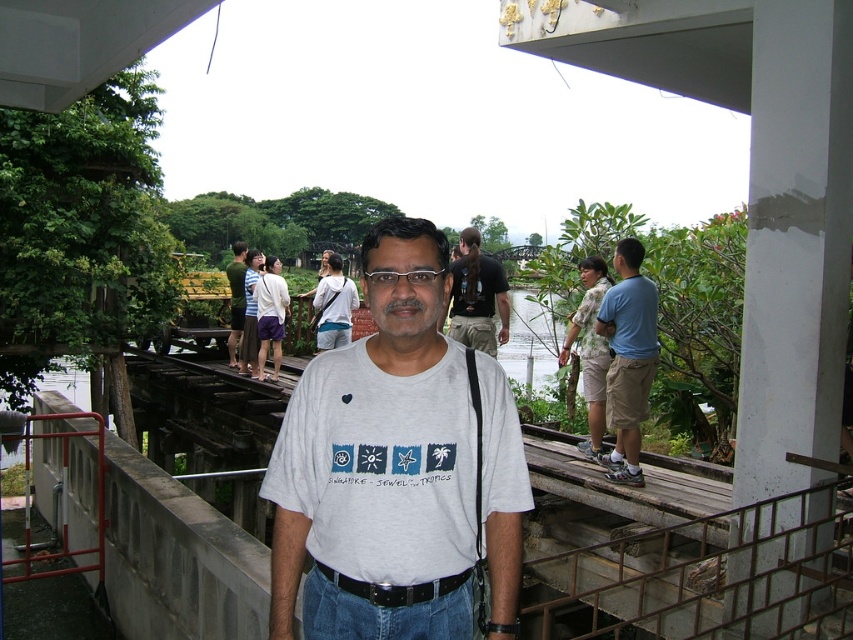
Does concrete railing at center have a lesser height compared to dark gray t-shirt at center?

No.

Is concrete railing at center thinner than dark gray t-shirt at center?

In fact, concrete railing at center might be wider than dark gray t-shirt at center.

Is point (811, 504) positioned in front of point (500, 301)?

Yes, it is.

The image size is (853, 640). What are the coordinates of `concrete railing at center` in the screenshot? It's located at (706, 576).

Is point (647, 310) less distant than point (351, 577)?

That is False.

Does blue cotton shirt at center come in front of black leather belt at center?

That is False.

Who is more distant from viewer, (x=643, y=419) or (x=408, y=588)?

The point (x=643, y=419) is more distant.

Find the location of `blue cotton shirt at center`. blue cotton shirt at center is located at coordinates (628, 358).

Can you confirm if concrete railing at center is positioned below black leather belt at center?

Yes, concrete railing at center is below black leather belt at center.

Can you confirm if concrete railing at center is bigger than black leather belt at center?

Yes, concrete railing at center is bigger than black leather belt at center.

Find the location of a particular element. concrete railing at center is located at coordinates (706, 576).